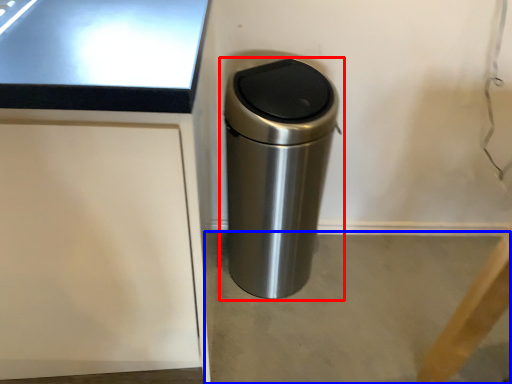
Question: Which object is further to the camera taking this photo, waste container (highlighted by a red box) or concrete (highlighted by a blue box)?

Choices:
 (A) waste container
 (B) concrete

Answer: (B)